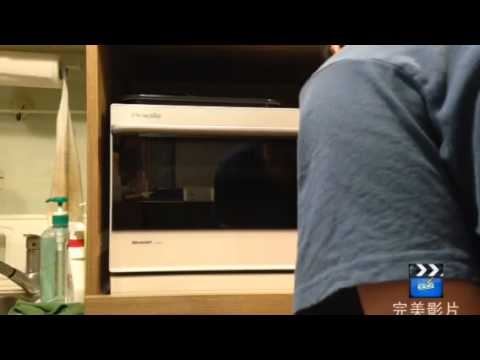
This screenshot has width=480, height=360. Identify the location of cleaning products. (53, 254), (79, 251), (83, 216).